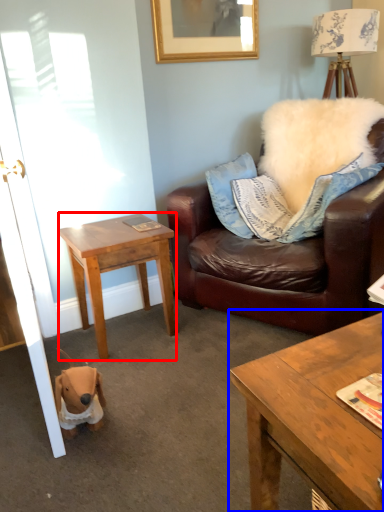
Question: Among these objects, which one is farthest to the camera, desk (highlighted by a red box) or coffee table (highlighted by a blue box)?

Choices:
 (A) desk
 (B) coffee table

Answer: (A)